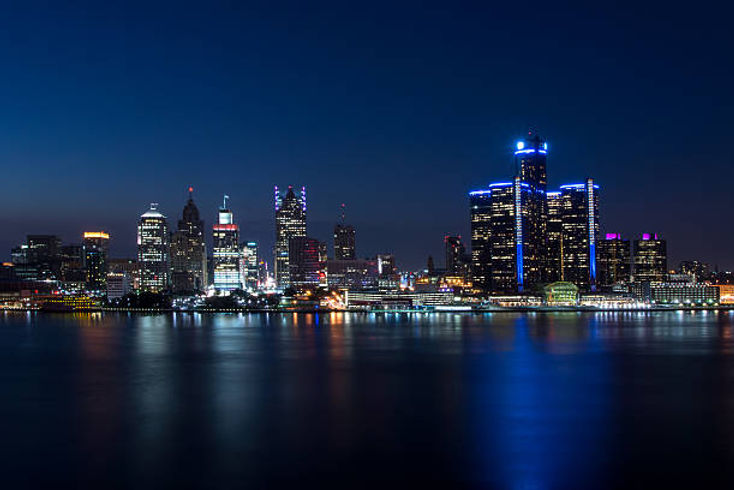
The image size is (734, 490). Find the location of `green lights`. green lights is located at coordinates (559, 291).